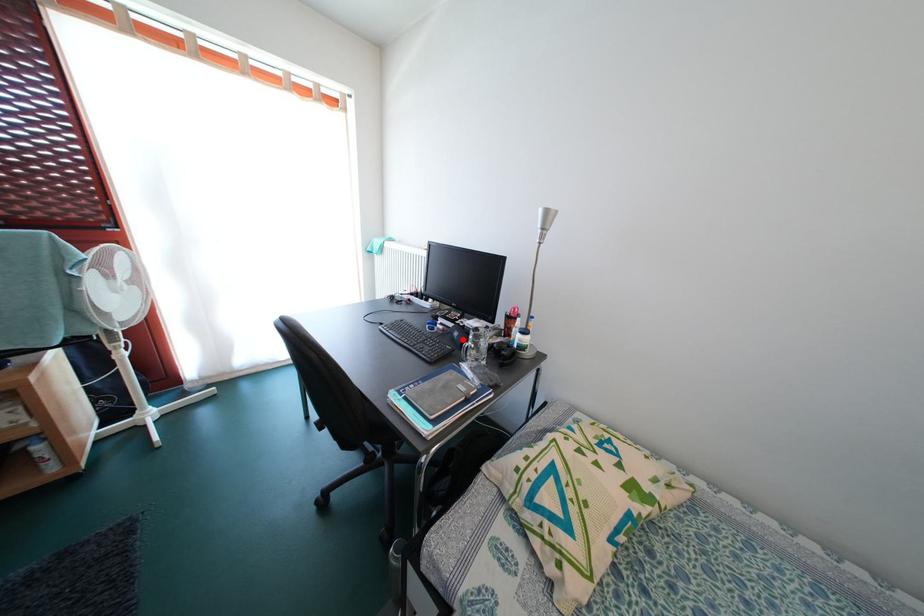
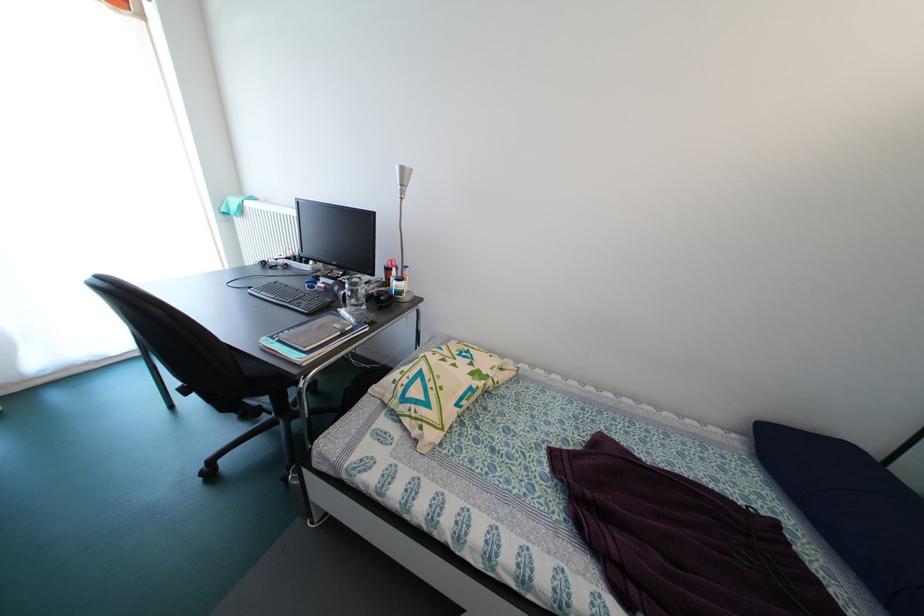
Question: A red point is marked in image1. In image2, is the corresponding 3D point closer to the camera or farther? Reply with the corresponding letter.

Choices:
 (A) The corresponding 3D point is closer.
 (B) The corresponding 3D point is farther.

Answer: (A)